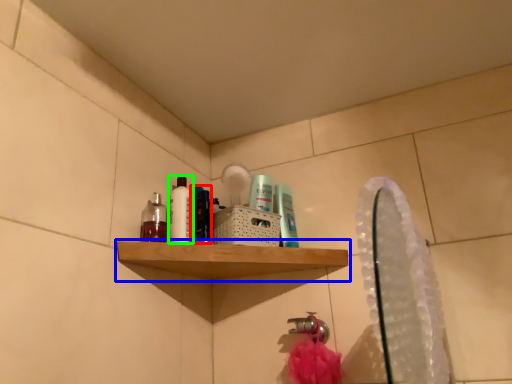
Question: Which object is positioned farthest from mouthwash (highlighted by a red box)? Select from shelf (highlighted by a blue box) and cleaning product (highlighted by a green box).

Choices:
 (A) shelf
 (B) cleaning product

Answer: (A)